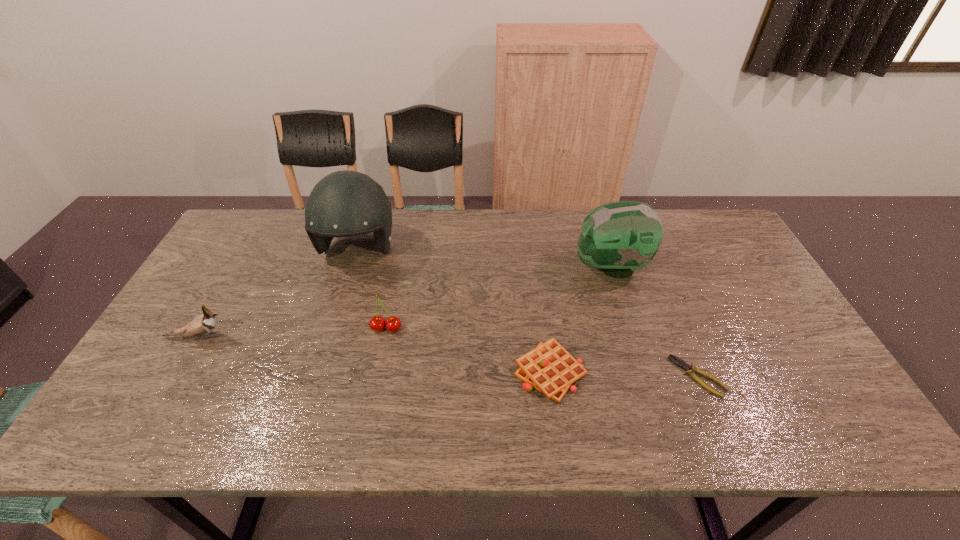
You are a GUI agent. You are given a task and a screenshot of the screen. Output one action in this format:
    pyautogui.click(x=<x>, y=<y>)
    Task: Click on the left football helmet
    
    Given the screenshot: What is the action you would take?
    pyautogui.click(x=345, y=203)

Where is `the tallest object`? This screenshot has width=960, height=540. the tallest object is located at coordinates (345, 203).

Where is `the fifth shortest object`? This screenshot has width=960, height=540. the fifth shortest object is located at coordinates (621, 237).

The height and width of the screenshot is (540, 960). In order to click on the right football helmet in this screenshot , I will do `click(621, 237)`.

Identify the location of the leftmost object. (203, 324).

Find the location of a particular element. Image resolution: width=960 pixels, height=540 pixels. cherry is located at coordinates (377, 323).

Find the location of a particular element. The height and width of the screenshot is (540, 960). the fourth object from left to right is located at coordinates (549, 368).

I want to click on waffle, so click(x=549, y=368).

The width and height of the screenshot is (960, 540). In order to click on the shortest object in this screenshot , I will do `click(690, 370)`.

Where is `vacant region located at the face opening of the taller football helmet`? The width and height of the screenshot is (960, 540). vacant region located at the face opening of the taller football helmet is located at coordinates (334, 330).